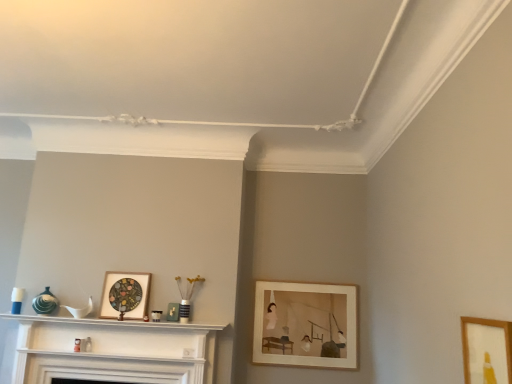
Identify the location of free location above white glossy fireplace at center (from a real-world perspective). The image size is (512, 384). (108, 329).